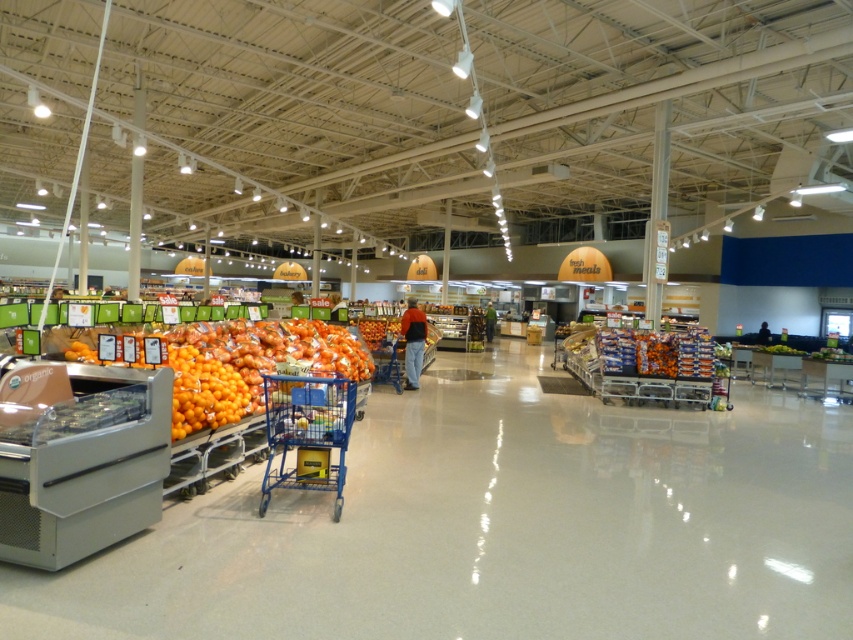
Between orange matte produce at left and blue plastic shopping cart at center, which one is positioned higher?

orange matte produce at left is higher up.

Can you confirm if orange matte produce at left is taller than blue plastic shopping cart at center?

No.

Is point (181, 419) closer to viewer compared to point (311, 435)?

Yes, point (181, 419) is closer to viewer.

Locate an element on the screen. The height and width of the screenshot is (640, 853). orange matte produce at left is located at coordinates (248, 364).